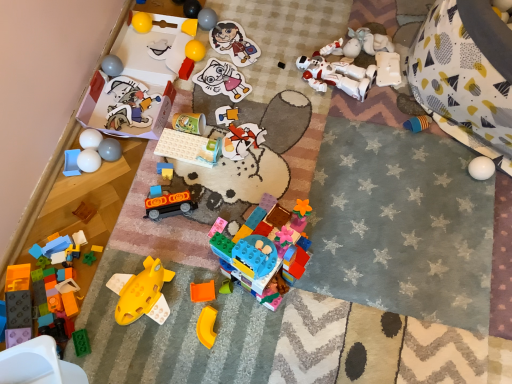
The width and height of the screenshot is (512, 384). What are the coordinates of `vacant space that is to the left of white plastic robot at upper right, arranged as the 22th toy when viewed from the left` in the screenshot? It's located at (328, 86).